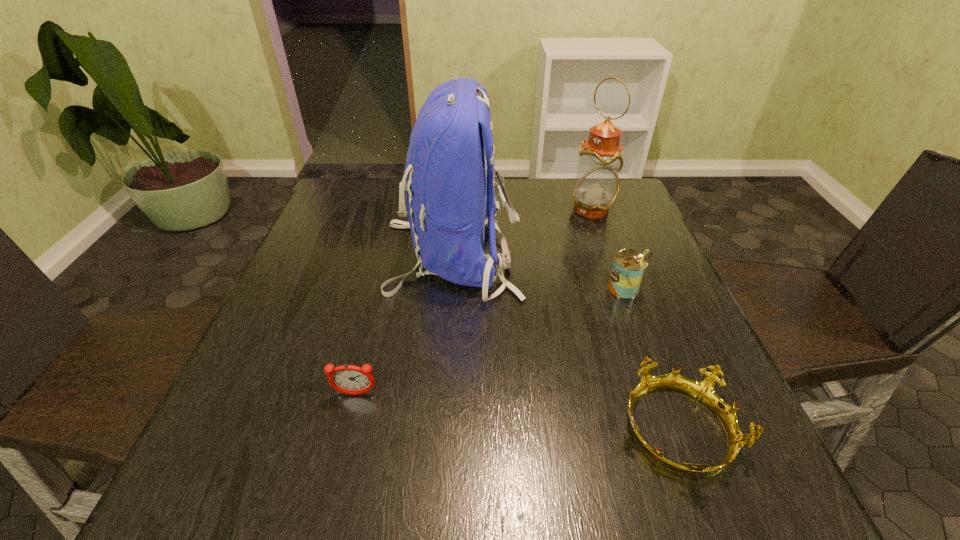
Where is `backpack`? The height and width of the screenshot is (540, 960). backpack is located at coordinates (448, 199).

Where is `oil lamp`? oil lamp is located at coordinates (596, 188).

You are a GUI agent. You are given a task and a screenshot of the screen. Output one action in this format:
    pyautogui.click(x=<x>, y=<y>)
    Task: Click on the third shortest object
    
    Given the screenshot: What is the action you would take?
    pyautogui.click(x=629, y=266)

Find the location of a particular element. alarm clock is located at coordinates (348, 379).

The height and width of the screenshot is (540, 960). I want to click on crown, so click(703, 391).

Identify the location of free space located on the back of the backpack. (634, 255).

You are a GUI agent. You are given a task and a screenshot of the screen. Output one action in this format:
    pyautogui.click(x=<x>, y=<y>)
    Task: Click on the vacant space located 0.340m on the left of the oil lamp
    
    Given the screenshot: What is the action you would take?
    pyautogui.click(x=449, y=210)

You are a GUI agent. You are given a task and a screenshot of the screen. Output one action in this format:
    pyautogui.click(x=<x>, y=<y>)
    Task: Click on the free space located on the front of the can
    
    Given the screenshot: What is the action you would take?
    (x=678, y=431)

The height and width of the screenshot is (540, 960). Identify the location of blank space located 0.100m on the front-facing side of the alarm clock. (341, 453).

The width and height of the screenshot is (960, 540). I want to click on free region located 0.060m on the back of the crown, so click(x=650, y=356).